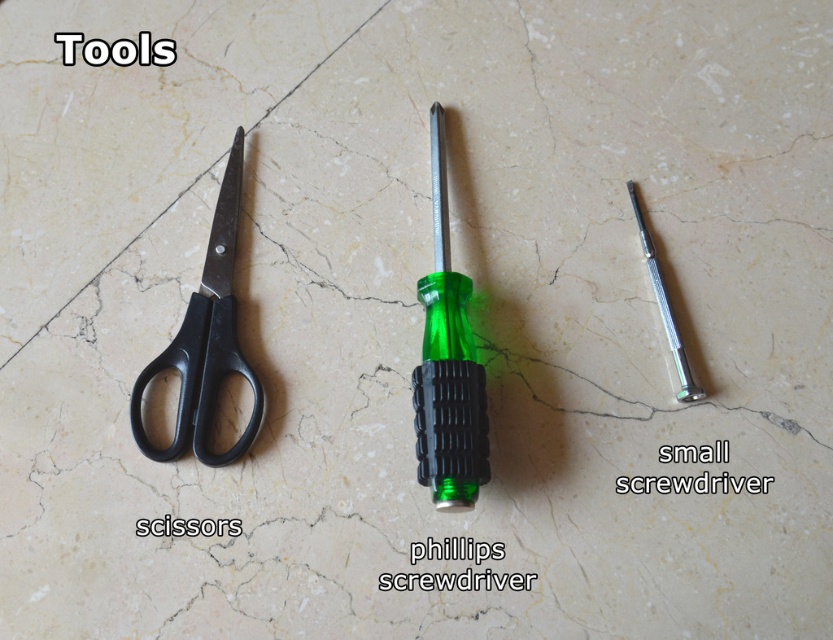
Question: Which object appears closest to the camera in this image?

Choices:
 (A) black plastic scissors at left
 (B) green plastic screwdriver at center
 (C) metallic silver handle at center

Answer: (B)

Question: Estimate the real-world distances between objects in this image. Which object is farther from the black plastic scissors at left?

Choices:
 (A) metallic silver handle at center
 (B) green plastic screwdriver at center

Answer: (A)

Question: Is green plastic screwdriver at center closer to camera compared to black plastic scissors at left?

Choices:
 (A) no
 (B) yes

Answer: (B)

Question: Considering the relative positions of black plastic scissors at left and metallic silver handle at center in the image provided, where is black plastic scissors at left located with respect to metallic silver handle at center?

Choices:
 (A) above
 (B) below

Answer: (B)

Question: Is green plastic screwdriver at center below black plastic scissors at left?

Choices:
 (A) no
 (B) yes

Answer: (B)

Question: Which of the following is the farthest from the observer?

Choices:
 (A) (253, 433)
 (B) (469, 451)

Answer: (A)